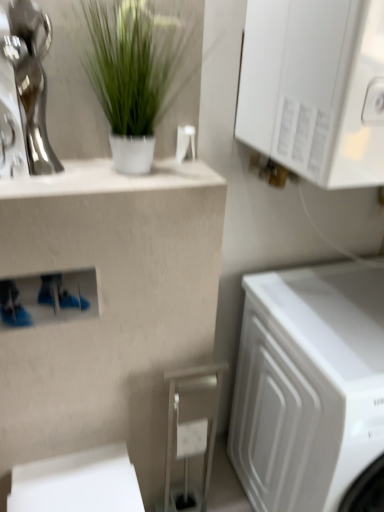
The height and width of the screenshot is (512, 384). Find the location of `free spot above white glossy counter top at upper left (from a real-world perspective)`. free spot above white glossy counter top at upper left (from a real-world perspective) is located at coordinates (110, 170).